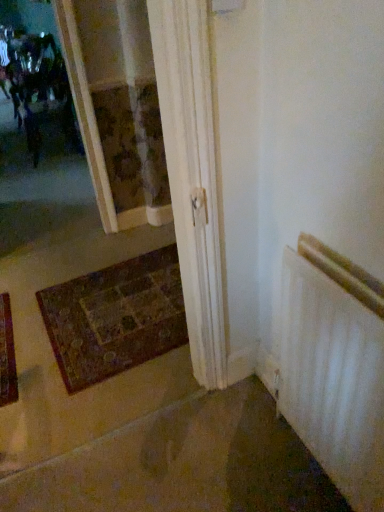
The height and width of the screenshot is (512, 384). Describe the element at coordinates (115, 317) in the screenshot. I see `multicolored woven mat at lower left` at that location.

What is the approximate height of multicolored woven mat at lower left?

It is 1.64 inches.

This screenshot has height=512, width=384. In order to click on multicolored woven mat at lower left in this screenshot , I will do `click(115, 317)`.

Describe the element at coordinates (335, 367) in the screenshot. This screenshot has height=512, width=384. I see `white matte radiator at lower right` at that location.

This screenshot has width=384, height=512. Identify the location of white matte radiator at lower right. (335, 367).

Locate an element on the screen. multicolored woven mat at lower left is located at coordinates (115, 317).

Does multicolored woven mat at lower left appear on the right side of white matte radiator at lower right?

In fact, multicolored woven mat at lower left is to the left of white matte radiator at lower right.

Which object is closer to the camera, multicolored woven mat at lower left or white matte radiator at lower right?

white matte radiator at lower right is closer to the camera.

Does point (107, 304) lie in front of point (311, 375)?

No, (107, 304) is behind (311, 375).

From the image's perspective, is multicolored woven mat at lower left above or below white matte radiator at lower right?

multicolored woven mat at lower left is situated higher than white matte radiator at lower right in the image.

Based on the photo, from a real-world perspective, is multicolored woven mat at lower left beneath white matte radiator at lower right?

Yes, from a real-world perspective, multicolored woven mat at lower left is under white matte radiator at lower right.

Looking at their sizes, would you say multicolored woven mat at lower left is wider or thinner than white matte radiator at lower right?

Clearly, multicolored woven mat at lower left has more width compared to white matte radiator at lower right.

From their relative heights in the image, would you say multicolored woven mat at lower left is taller or shorter than white matte radiator at lower right?

Clearly, multicolored woven mat at lower left is shorter compared to white matte radiator at lower right.

Considering the sizes of objects multicolored woven mat at lower left and white matte radiator at lower right in the image provided, who is smaller, multicolored woven mat at lower left or white matte radiator at lower right?

Smaller between the two is multicolored woven mat at lower left.

Based on the photo, is multicolored woven mat at lower left inside or outside of white matte radiator at lower right?

multicolored woven mat at lower left is spatially situated outside white matte radiator at lower right.

From the picture: Is multicolored woven mat at lower left next to white matte radiator at lower right?

multicolored woven mat at lower left is not next to white matte radiator at lower right, and they're not touching.

Is multicolored woven mat at lower left facing away from white matte radiator at lower right?

No, multicolored woven mat at lower left's orientation is not away from white matte radiator at lower right.

How far apart are multicolored woven mat at lower left and white matte radiator at lower right?

A distance of 3.48 feet exists between multicolored woven mat at lower left and white matte radiator at lower right.

You are a GUI agent. You are given a task and a screenshot of the screen. Output one action in this format:
    pyautogui.click(x=<x>, y=<y>)
    Task: Click on the mat located underneath the white matte radiator at lower right (from a real-world perspective)
    
    Given the screenshot: What is the action you would take?
    (115, 317)

Does white matte radiator at lower right appear on the right side of multicolored woven mat at lower left?

Yes, white matte radiator at lower right is to the right of multicolored woven mat at lower left.

Is white matte radiator at lower right behind multicolored woven mat at lower left?

No, the depth of white matte radiator at lower right is less than that of multicolored woven mat at lower left.

From the picture: Which point is more distant from viewer, (323, 457) or (175, 298)?

The point (175, 298) is more distant.

From the image's perspective, which one is positioned higher, white matte radiator at lower right or multicolored woven mat at lower left?

multicolored woven mat at lower left, from the image's perspective.

From the picture: From a real-world perspective, is white matte radiator at lower right physically located above or below multicolored woven mat at lower left?

In terms of real-world spatial position, white matte radiator at lower right is above multicolored woven mat at lower left.

Is white matte radiator at lower right wider or thinner than multicolored woven mat at lower left?

Considering their sizes, white matte radiator at lower right looks slimmer than multicolored woven mat at lower left.

Is white matte radiator at lower right taller than multicolored woven mat at lower left?

Correct, white matte radiator at lower right is much taller as multicolored woven mat at lower left.

Does white matte radiator at lower right have a smaller size compared to multicolored woven mat at lower left?

No, white matte radiator at lower right is not smaller than multicolored woven mat at lower left.

Is white matte radiator at lower right spatially inside multicolored woven mat at lower left, or outside of it?

white matte radiator at lower right is located beyond the bounds of multicolored woven mat at lower left.

Would you say white matte radiator at lower right is a long distance from multicolored woven mat at lower left?

Indeed, white matte radiator at lower right is not near multicolored woven mat at lower left.

Looking at this image, could you tell me if white matte radiator at lower right is facing multicolored woven mat at lower left?

No, white matte radiator at lower right does not turn towards multicolored woven mat at lower left.

From the picture: Measure the distance between white matte radiator at lower right and multicolored woven mat at lower left.

white matte radiator at lower right and multicolored woven mat at lower left are 3.48 feet apart.

I want to click on radiator that appears above the multicolored woven mat at lower left (from a real-world perspective), so click(x=335, y=367).

Where is `mat located behind the white matte radiator at lower right`? The height and width of the screenshot is (512, 384). mat located behind the white matte radiator at lower right is located at coordinates (115, 317).

This screenshot has height=512, width=384. What are the coordinates of `mat below the white matte radiator at lower right (from a real-world perspective)` in the screenshot? It's located at (115, 317).